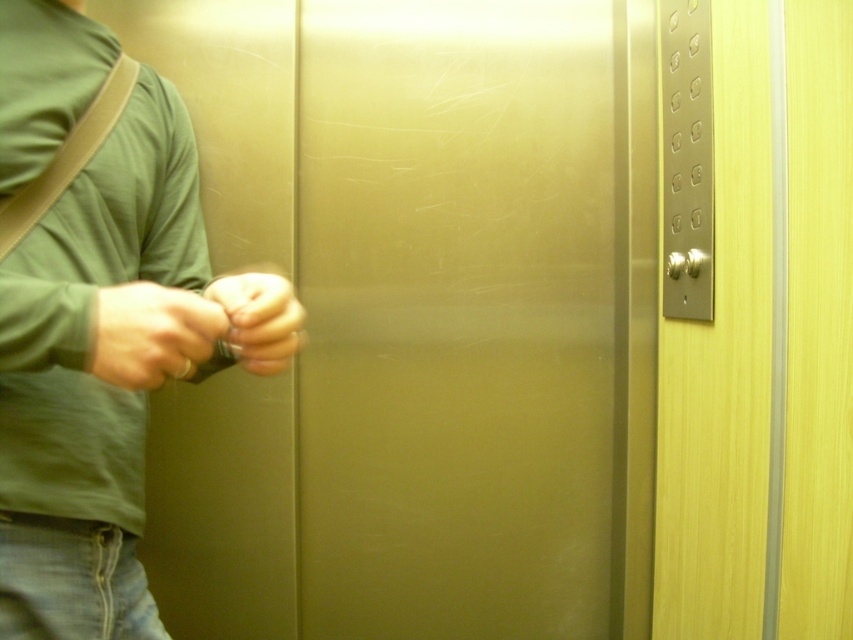
Looking at this image, between matte green shirt at left and matte silver ring at center, which one is positioned higher?

matte silver ring at center is higher up.

Does point (93, 372) come in front of point (238, 316)?

Yes, it is.

Image resolution: width=853 pixels, height=640 pixels. What are the coordinates of `matte green shirt at left` in the screenshot? It's located at (94, 304).

At what (x,y) coordinates should I click in order to perform the action: click on matte green shirt at left. Please return your answer as a coordinate pair (x, y). The height and width of the screenshot is (640, 853). Looking at the image, I should click on (94, 304).

Does matte black hand at center come in front of matte silver ring at center?

Yes, matte black hand at center is closer to the viewer.

Can you confirm if matte black hand at center is taller than matte silver ring at center?

Incorrect, matte black hand at center's height is not larger of matte silver ring at center's.

What do you see at coordinates (152, 333) in the screenshot? Image resolution: width=853 pixels, height=640 pixels. I see `matte black hand at center` at bounding box center [152, 333].

Find the location of a particular element. matte black hand at center is located at coordinates (152, 333).

Can you confirm if satin gold elevator door at center is positioned above matte silver ring at center?

Incorrect, satin gold elevator door at center is not positioned above matte silver ring at center.

Does satin gold elevator door at center appear on the right side of matte silver ring at center?

Indeed, satin gold elevator door at center is positioned on the right side of matte silver ring at center.

This screenshot has width=853, height=640. Describe the element at coordinates (456, 320) in the screenshot. I see `satin gold elevator door at center` at that location.

Identify the location of satin gold elevator door at center. coord(456,320).